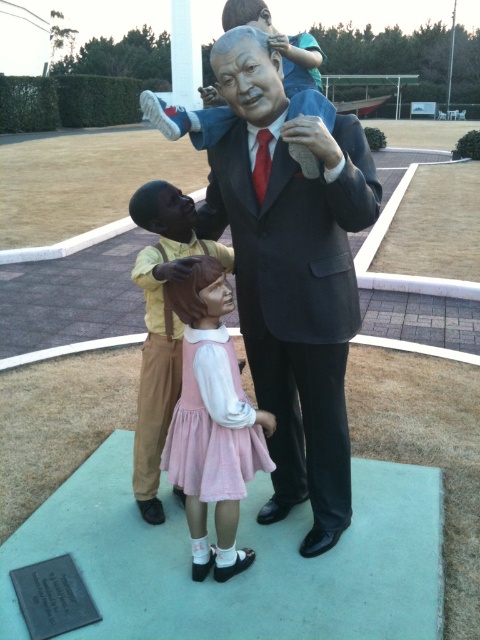
You are standing in front of the statue group. The statue of the man in the center is pointing towards two specific points. The first point is at coordinates point [219,568], and the second point is at coordinates point [133,436]. Which point is closer to the statue of the man in the center?

Point [219,568] is in front of point [133,436], so it is closer to the statue of the man in the center.

From the picture: Based on the scene description, which object is taller between the matte black suit at center and the pink fabric dress at center?

The matte black suit at center is much taller than the pink fabric dress at center.